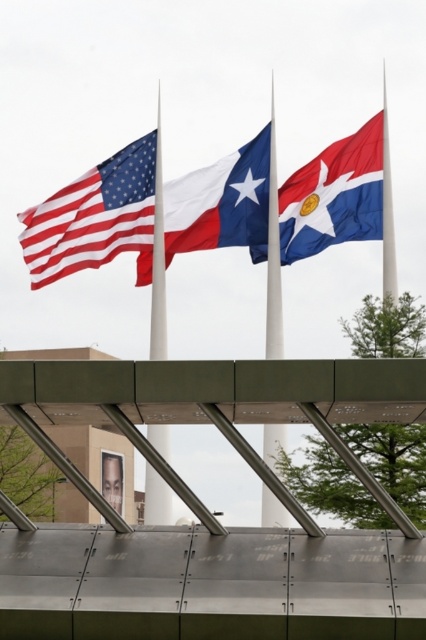
Question: Among these objects, which one is nearest to the camera?

Choices:
 (A) american flag at center
 (B) blue and white fabric flag at upper right
 (C) white glossy flag pole at center
 (D) matte fabric american flag at left

Answer: (C)

Question: Is blue and white fabric flag at upper right further to the viewer compared to polished silver flag pole at center?

Choices:
 (A) yes
 (B) no

Answer: (A)

Question: Is matte fabric american flag at left thinner than american flag at center?

Choices:
 (A) no
 (B) yes

Answer: (A)

Question: Which object is the farthest from the polished silver flag pole at center?

Choices:
 (A) american flag at center
 (B) blue and white fabric flag at upper right
 (C) matte fabric american flag at left

Answer: (C)

Question: Is matte fabric american flag at left wider than polished silver flag pole at center?

Choices:
 (A) yes
 (B) no

Answer: (A)

Question: Estimate the real-world distances between objects in this image. Which object is closer to the matte fabric american flag at left?

Choices:
 (A) white glossy flag pole at center
 (B) american flag at center

Answer: (B)